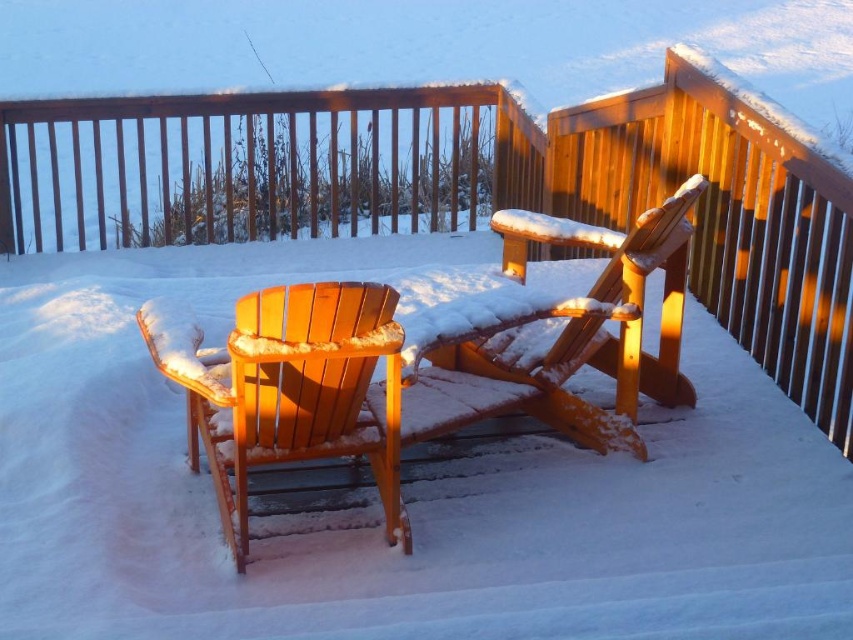
Question: Can you confirm if matte wood chair at left is wider than matte wood chair at center?

Choices:
 (A) no
 (B) yes

Answer: (A)

Question: Is wooden railing at upper center positioned before matte wood chair at left?

Choices:
 (A) yes
 (B) no

Answer: (B)

Question: Among these objects, which one is farthest from the camera?

Choices:
 (A) matte wood chair at center
 (B) matte wood chair at left
 (C) wooden railing at upper center

Answer: (C)

Question: Among these objects, which one is farthest from the camera?

Choices:
 (A) wooden railing at upper center
 (B) matte wood chair at left
 (C) matte wood chair at center

Answer: (A)

Question: Which of the following is the farthest from the observer?

Choices:
 (A) wooden railing at upper center
 (B) matte wood chair at center

Answer: (A)

Question: Does wooden railing at upper center have a greater width compared to matte wood chair at center?

Choices:
 (A) no
 (B) yes

Answer: (B)